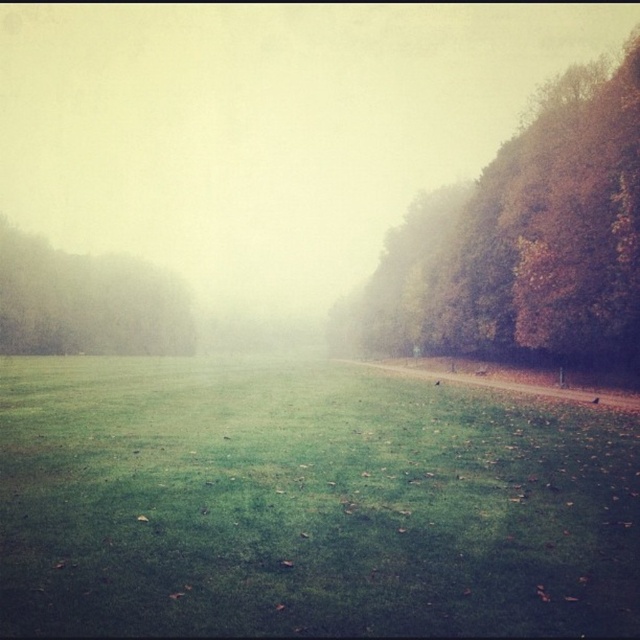
Question: Which point is closer to the camera?

Choices:
 (A) (52, 312)
 (B) (109, 531)

Answer: (B)

Question: Is green grassy field at center positioned in front of autumn leaves at right?

Choices:
 (A) no
 (B) yes

Answer: (B)

Question: Which of these objects is positioned farthest from the green grassy field at center?

Choices:
 (A) autumn leaves at right
 (B) green matte tree at left

Answer: (B)

Question: In this image, where is autumn leaves at right located relative to green matte tree at left?

Choices:
 (A) below
 (B) above

Answer: (B)

Question: Estimate the real-world distances between objects in this image. Which object is closer to the autumn leaves at right?

Choices:
 (A) green grassy field at center
 (B) green matte tree at left

Answer: (A)

Question: Is autumn leaves at right bigger than green matte tree at left?

Choices:
 (A) yes
 (B) no

Answer: (A)